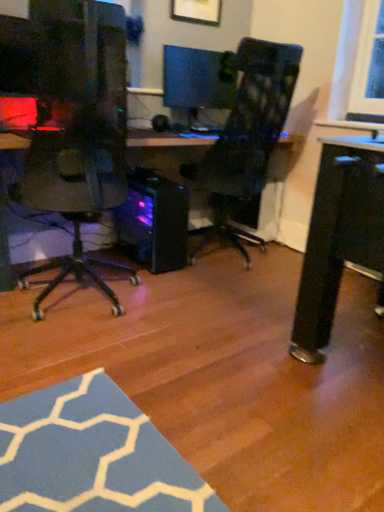
Where is `vacant area that is in front of transparent plastic computer tower at center`? The height and width of the screenshot is (512, 384). vacant area that is in front of transparent plastic computer tower at center is located at coordinates (132, 282).